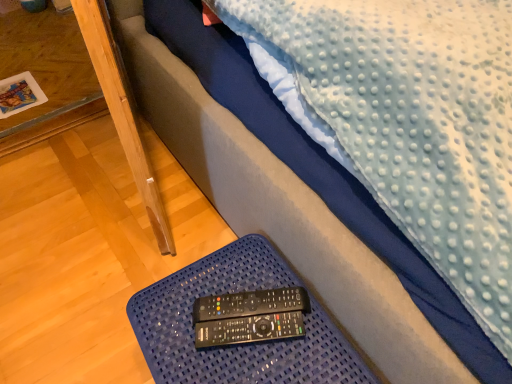
The width and height of the screenshot is (512, 384). What are the coordinates of `free spot to the right of black plastic remote at lower center, which ranks as the 1th control in back-to-front order` in the screenshot? It's located at (320, 322).